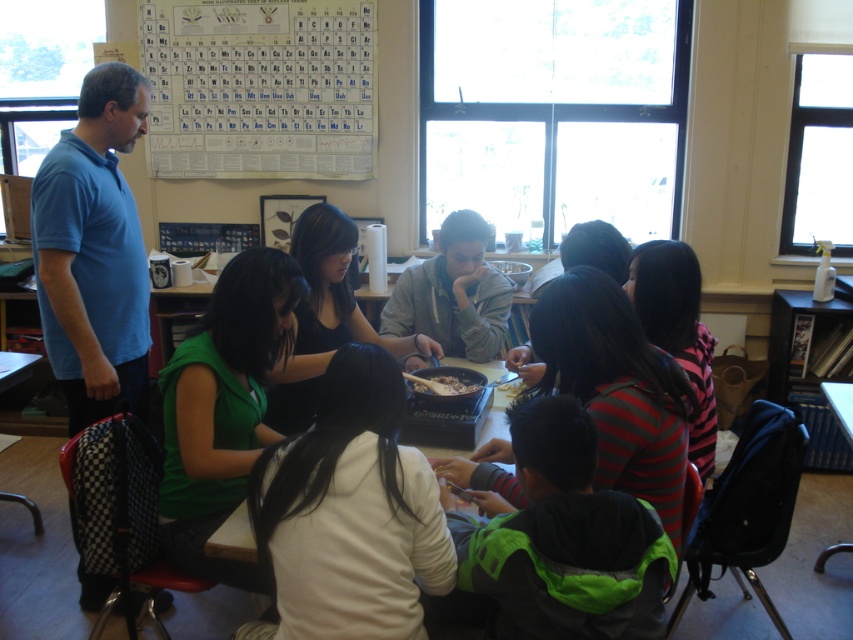
You are standing in the classroom and want to take a closer look at the pan on the table. The pan is at point (505, 332). If you walk straight ahead, will you reach the pan before walking 3 meters?

The point (505, 332) where the pan is located is 2.82 meters from the camera, so yes, walking straight ahead will reach the pan before 3 meters since it is closer than that distance.

You are a student in the classroom and want to reach for the brown matte food at center without moving the gray matte jacket at center. Is this possible?

The gray matte jacket at center is positioned on the right side of brown matte food at center, so you can reach the brown matte food at center from the left side without disturbing the jacket.

Where is the blue cotton shirt at left located in the image?

The blue cotton shirt at left is located at point (94, 252).